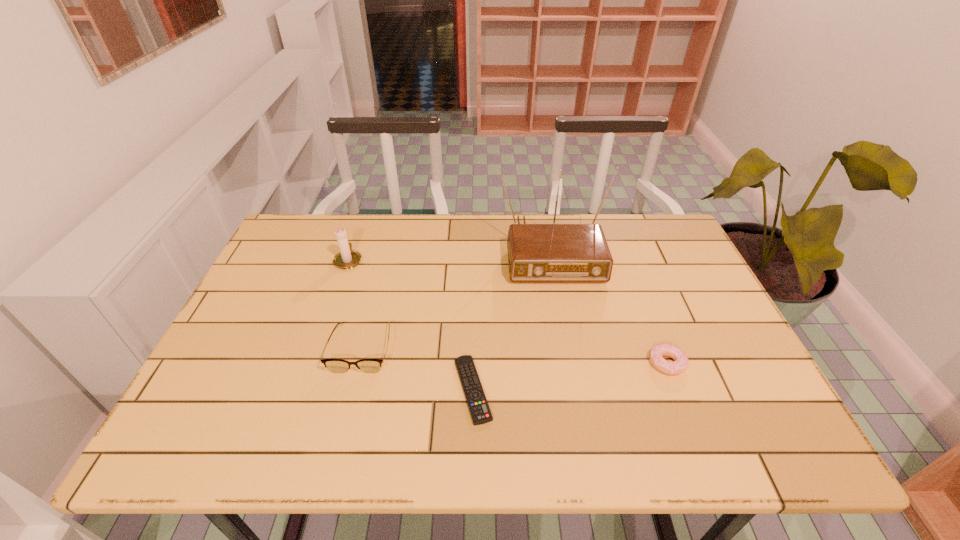
I want to click on blank space at the left edge, so click(300, 261).

Where is `vacant area at the right edge of the desktop`? This screenshot has height=540, width=960. vacant area at the right edge of the desktop is located at coordinates (709, 368).

Where is `vacant space at the far left corner`? vacant space at the far left corner is located at coordinates (292, 253).

The image size is (960, 540). Find the location of `free location at the near left corner`. free location at the near left corner is located at coordinates (199, 449).

The width and height of the screenshot is (960, 540). What are the coordinates of `vacant space at the far right corner of the desktop` in the screenshot? It's located at (621, 221).

Where is `free space between the spectacles and the shortest object`? free space between the spectacles and the shortest object is located at coordinates (418, 369).

Where is `vacant space in between the remote control and the candle holder`? This screenshot has width=960, height=540. vacant space in between the remote control and the candle holder is located at coordinates (411, 325).

In order to click on free spot between the shortest object and the radio_receiver in this screenshot , I will do `click(511, 319)`.

You are a GUI agent. You are given a task and a screenshot of the screen. Output one action in this format:
    pyautogui.click(x=<x>, y=<y>)
    Task: Click on the unoccupied area between the spectacles and the rightmost object
    
    Given the screenshot: What is the action you would take?
    pyautogui.click(x=515, y=356)

Identify the location of unoccupied position between the spectacles and the fourth object from left to right. The width and height of the screenshot is (960, 540). (455, 298).